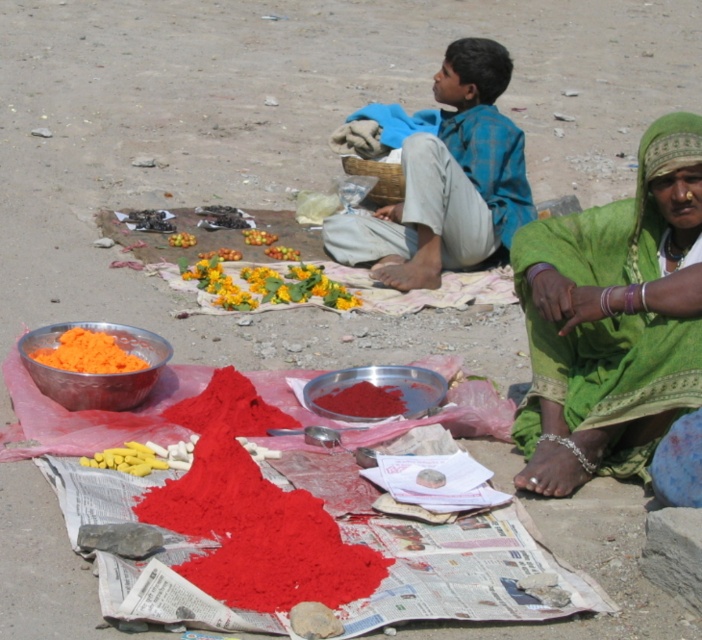
Based on the photo, does orange powder at lower left have a lesser width compared to yellow matte flower at center?

In fact, orange powder at lower left might be wider than yellow matte flower at center.

Which is in front, point (124, 371) or point (289, 253)?

Point (124, 371) is more forward.

At what (x,y) coordinates should I click in order to perform the action: click on orange powder at lower left. Please return your answer as a coordinate pair (x, y). Looking at the image, I should click on (88, 353).

From the picture: Who is taller, green fabric at lower right or yellow fruit at center?

Standing taller between the two is green fabric at lower right.

At what (x,y) coordinates should I click in order to perform the action: click on green fabric at lower right. Please return your answer as a coordinate pair (x, y). The height and width of the screenshot is (640, 702). Looking at the image, I should click on (614, 320).

Does point (696, 360) come closer to viewer compared to point (264, 241)?

Yes.

Where is `green fabric at lower right`? green fabric at lower right is located at coordinates tap(614, 320).

Who is more distant from viewer, (340, 394) or (172, 234)?

The point (172, 234) is more distant.

What do you see at coordinates (362, 401) in the screenshot? The height and width of the screenshot is (640, 702). I see `bright red powder at center` at bounding box center [362, 401].

The height and width of the screenshot is (640, 702). I want to click on bright red powder at center, so [362, 401].